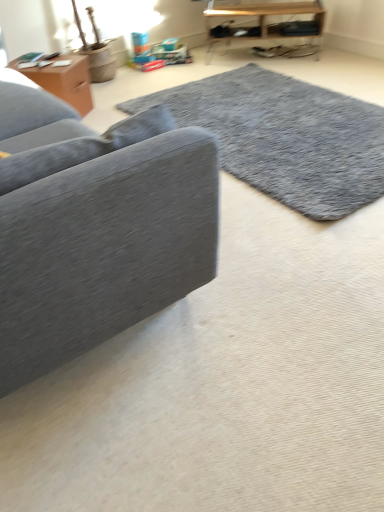
Question: From the image's perspective, is wooden shelf at upper right, acting as the 1th table starting from the top, located above or below matte brown wooden table at upper left, the 2th table from the right?

Choices:
 (A) above
 (B) below

Answer: (A)

Question: Considering the relative positions of wooden shelf at upper right, the 1th table in the right-to-left sequence, and matte brown wooden table at upper left, which ranks as the first table in front-to-back order, in the image provided, is wooden shelf at upper right, the 1th table in the right-to-left sequence, to the left or to the right of matte brown wooden table at upper left, which ranks as the first table in front-to-back order,?

Choices:
 (A) right
 (B) left

Answer: (A)

Question: Which of these objects is positioned closest to the velvet gray couch at left?

Choices:
 (A) gray shaggy rug at center
 (B) matte brown wooden table at upper left, arranged as the 2th table when viewed from the top
 (C) wooden shelf at upper right, positioned as the 2th table in left-to-right order

Answer: (A)

Question: Which object is the farthest from the matte brown wooden table at upper left, which ranks as the first table in front-to-back order?

Choices:
 (A) wooden shelf at upper right, placed as the 2th table when sorted from front to back
 (B) velvet gray couch at left
 (C) gray shaggy rug at center

Answer: (B)